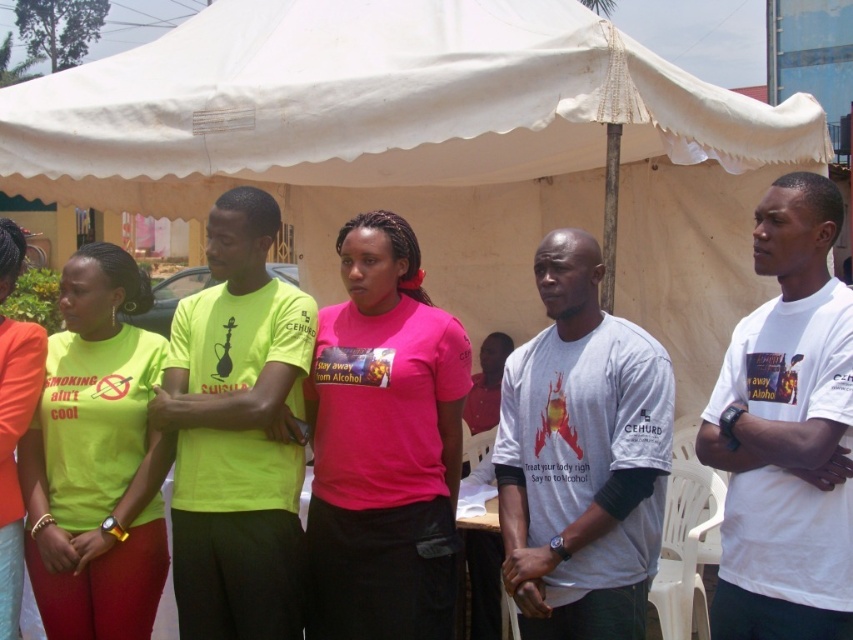
Does pink matte shirt at center have a smaller size compared to white matte shirt at center?

Indeed, pink matte shirt at center has a smaller size compared to white matte shirt at center.

Between pink matte shirt at center and white matte shirt at center, which one is positioned higher?

Positioned higher is pink matte shirt at center.

Which is behind, point (434, 579) or point (514, 394)?

The point (514, 394) is behind.

The height and width of the screenshot is (640, 853). I want to click on pink matte shirt at center, so click(383, 445).

Is white matte t-shirt at center behind matte green t-shirt at left?

No, it is in front of matte green t-shirt at left.

Who is shorter, white matte t-shirt at center or matte green t-shirt at left?

With less height is white matte t-shirt at center.

Does point (758, 611) come in front of point (30, 356)?

Yes, point (758, 611) is in front of point (30, 356).

Locate an element on the screen. white matte t-shirt at center is located at coordinates (786, 432).

Who is lower down, white matte t-shirt at center or neon yellow t-shirt at left?

Positioned lower is neon yellow t-shirt at left.

Can you confirm if white matte t-shirt at center is shorter than neon yellow t-shirt at left?

In fact, white matte t-shirt at center may be taller than neon yellow t-shirt at left.

Which is behind, point (785, 403) or point (155, 561)?

The point (155, 561) is more distant.

Where is `white matte t-shirt at center`? white matte t-shirt at center is located at coordinates (786, 432).